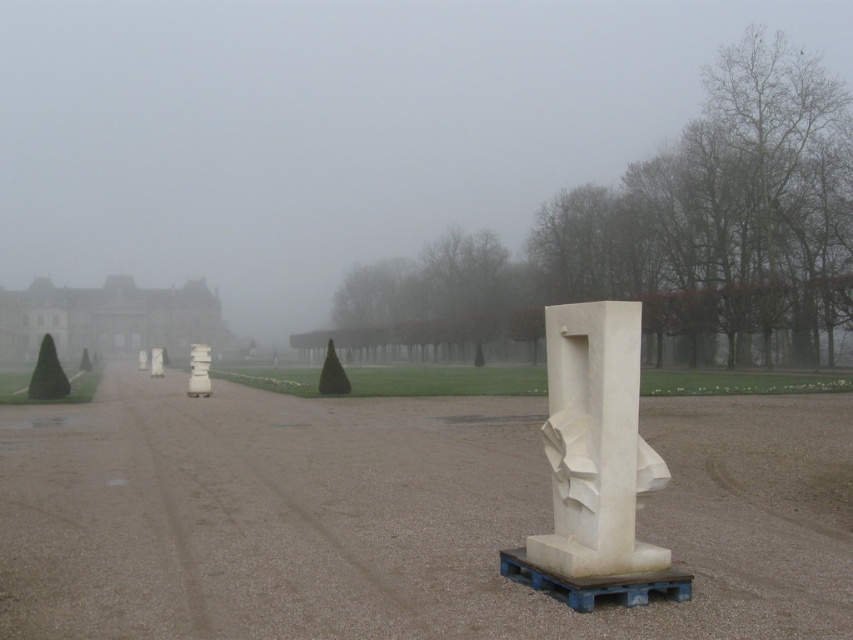
Who is shorter, brown gravel dirt track at center or white marble sculpture at center?

Standing shorter between the two is brown gravel dirt track at center.

Which is in front, point (648, 611) or point (590, 474)?

Point (648, 611) is more forward.

Who is more forward, [489,545] or [595,378]?

Point [595,378] is more forward.

What are the coordinates of `brown gravel dirt track at center` in the screenshot? It's located at (398, 516).

Can you confirm if white marble sculpture at center is wider than white stone palace at left?

No.

Does white marble sculpture at center come behind white stone palace at left?

No, white marble sculpture at center is closer to the viewer.

The image size is (853, 640). Describe the element at coordinates (595, 465) in the screenshot. I see `white marble sculpture at center` at that location.

At what (x,y) coordinates should I click in order to perform the action: click on white marble sculpture at center. Please return your answer as a coordinate pair (x, y). This screenshot has width=853, height=640. Looking at the image, I should click on (595, 465).

I want to click on brown gravel dirt track at center, so tap(398, 516).

Can you confirm if brown gravel dirt track at center is positioned above white stone palace at left?

Actually, brown gravel dirt track at center is below white stone palace at left.

Which is in front, point (299, 492) or point (138, 346)?

Point (299, 492) is in front.

Locate an element on the screen. This screenshot has width=853, height=640. brown gravel dirt track at center is located at coordinates (398, 516).